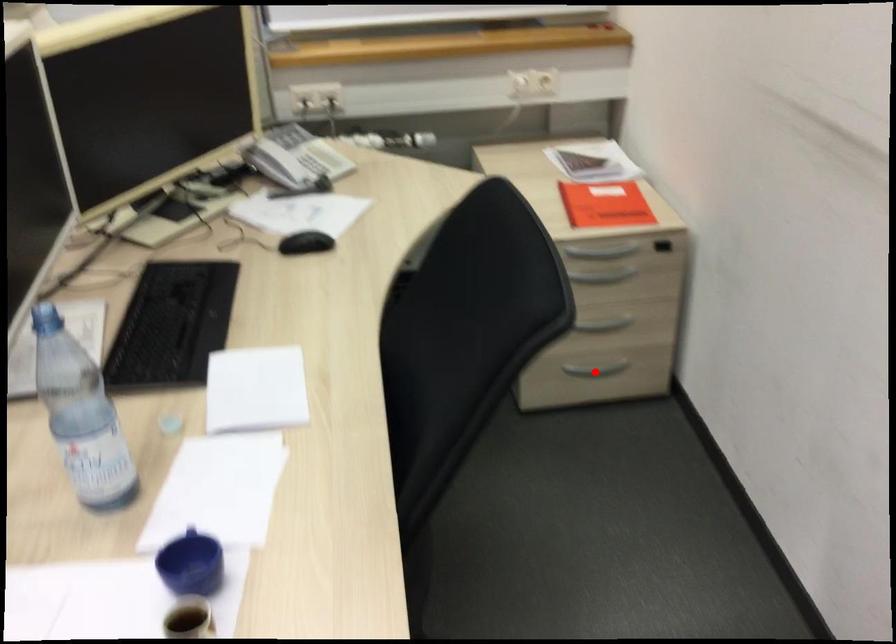
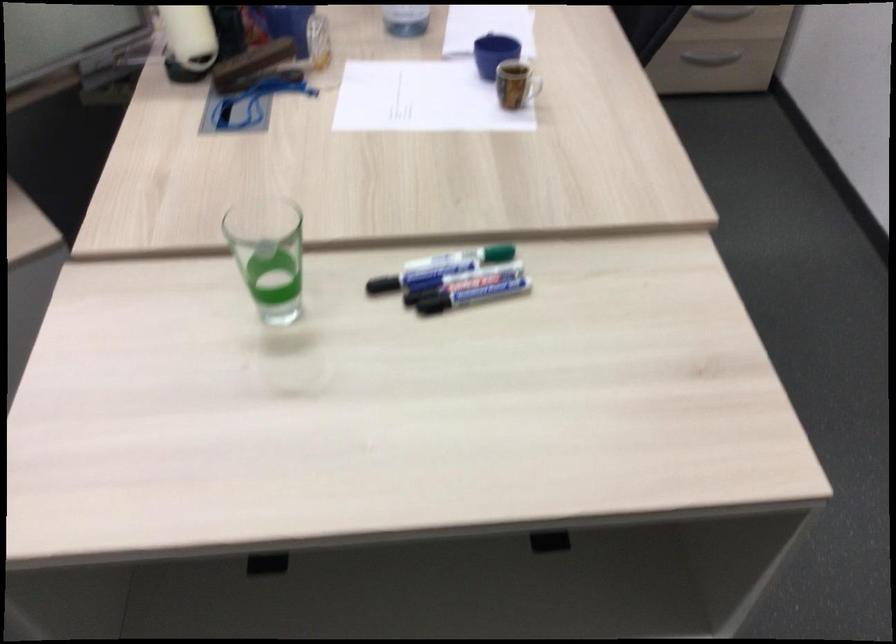
Locate, in the second image, the point that corresponds to the highlighted location in the first image.

(708, 61)